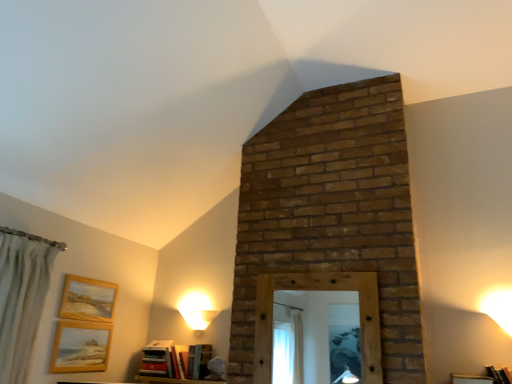
Question: Is hardcover books at lower center, the 2th book when ordered from right to left, positioned with its back to green textured curtain at left?

Choices:
 (A) yes
 (B) no

Answer: (B)

Question: Is hardcover books at lower center, the 2th book when ordered from right to left, smaller than green textured curtain at left?

Choices:
 (A) no
 (B) yes

Answer: (B)

Question: Does hardcover books at lower center, the 2th book when ordered from right to left, touch green textured curtain at left?

Choices:
 (A) no
 (B) yes

Answer: (A)

Question: From the image's perspective, is hardcover books at lower center, the 2th book when ordered from right to left, on top of green textured curtain at left?

Choices:
 (A) no
 (B) yes

Answer: (A)

Question: From a real-world perspective, is hardcover books at lower center, acting as the second book starting from the left, physically above green textured curtain at left?

Choices:
 (A) no
 (B) yes

Answer: (A)

Question: Is hardcover books at lower center, the 2th book when ordered from right to left, taller or shorter than wooden mirror at center?

Choices:
 (A) tall
 (B) short

Answer: (B)

Question: From a real-world perspective, is hardcover books at lower center, the 2th book when ordered from right to left, above or below wooden mirror at center?

Choices:
 (A) above
 (B) below

Answer: (B)

Question: Considering the positions of hardcover books at lower center, acting as the second book starting from the left, and wooden mirror at center in the image, is hardcover books at lower center, acting as the second book starting from the left, bigger or smaller than wooden mirror at center?

Choices:
 (A) big
 (B) small

Answer: (B)

Question: Would you say hardcover books at lower center, the 2th book when ordered from right to left, is to the left or to the right of wooden mirror at center in the picture?

Choices:
 (A) left
 (B) right

Answer: (A)

Question: Considering the positions of point (202, 324) and point (282, 288), is point (202, 324) closer or farther from the camera than point (282, 288)?

Choices:
 (A) farther
 (B) closer

Answer: (A)

Question: Is white glossy table lamp at lower left spatially inside wooden mirror at center, or outside of it?

Choices:
 (A) inside
 (B) outside

Answer: (B)

Question: Considering the positions of white glossy table lamp at lower left and wooden mirror at center in the image, is white glossy table lamp at lower left wider or thinner than wooden mirror at center?

Choices:
 (A) thin
 (B) wide

Answer: (B)

Question: Would you say white glossy table lamp at lower left is to the left or to the right of wooden mirror at center in the picture?

Choices:
 (A) right
 (B) left

Answer: (B)

Question: Is wooden frame at lower right, acting as the 2th furniture starting from the left, spatially inside wooden mirror at center, or outside of it?

Choices:
 (A) outside
 (B) inside

Answer: (A)

Question: Considering the positions of wooden frame at lower right, marked as the 1th furniture in a right-to-left arrangement, and wooden mirror at center in the image, is wooden frame at lower right, marked as the 1th furniture in a right-to-left arrangement, wider or thinner than wooden mirror at center?

Choices:
 (A) wide
 (B) thin

Answer: (A)